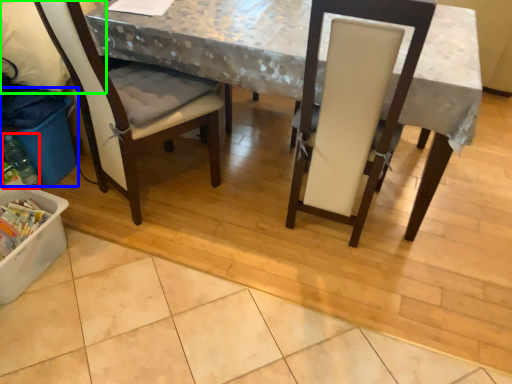
Question: Which object is the farthest from bottle (highlighted by a red box)? Choose among these: recycling bin (highlighted by a blue box) or leftover (highlighted by a green box).

Choices:
 (A) recycling bin
 (B) leftover

Answer: (B)